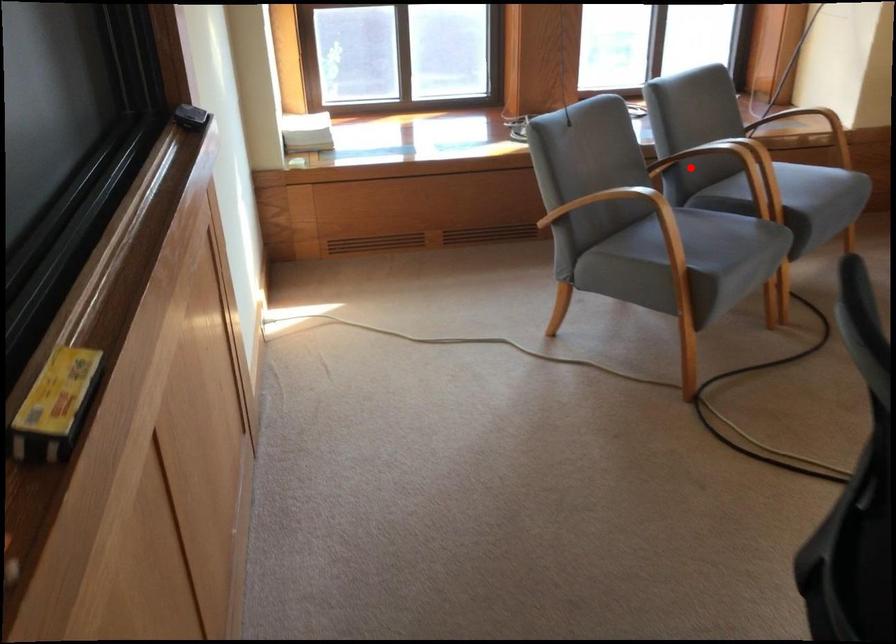
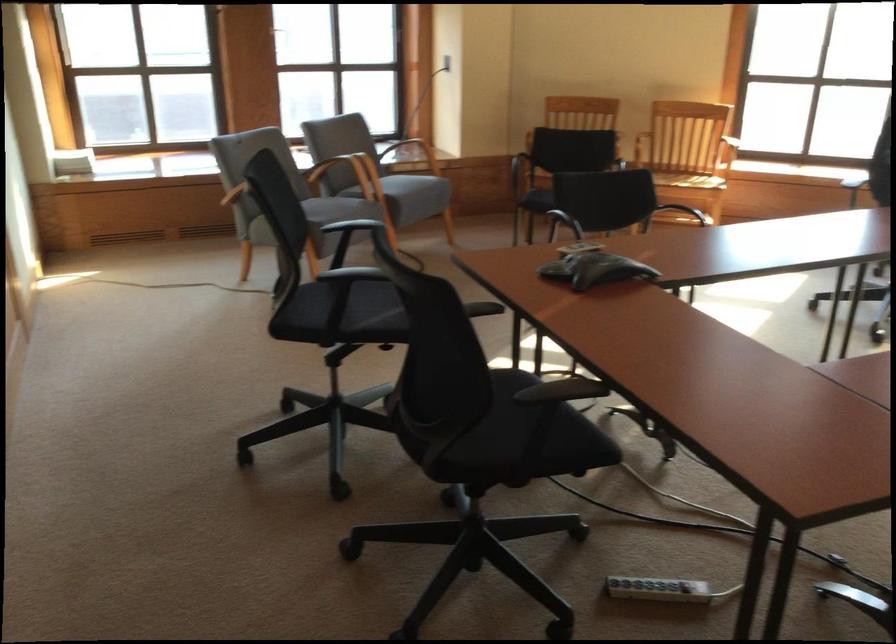
Where in the second image is the point corresponding to the highlighted location from the first image?

(342, 172)